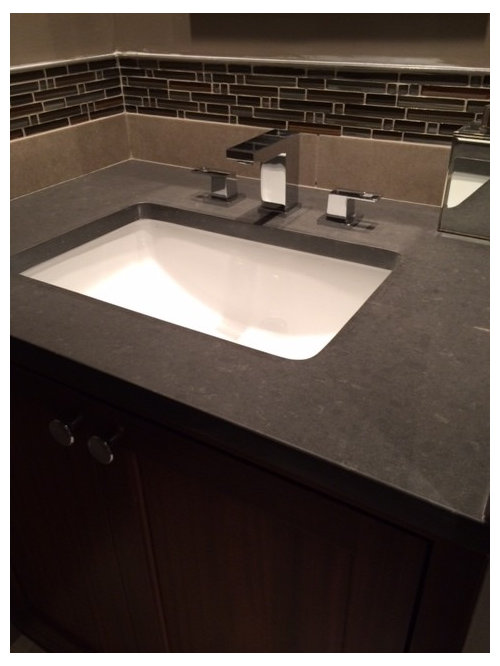
You are a GUI agent. You are given a task and a screenshot of the screen. Output one action in this format:
    pyautogui.click(x=<x>, y=<y>)
    Task: Click on the thing pulled to open a cabinet drawer
    This screenshot has height=666, width=500.
    Given the screenshot: What is the action you would take?
    pyautogui.click(x=100, y=449), pyautogui.click(x=59, y=432)